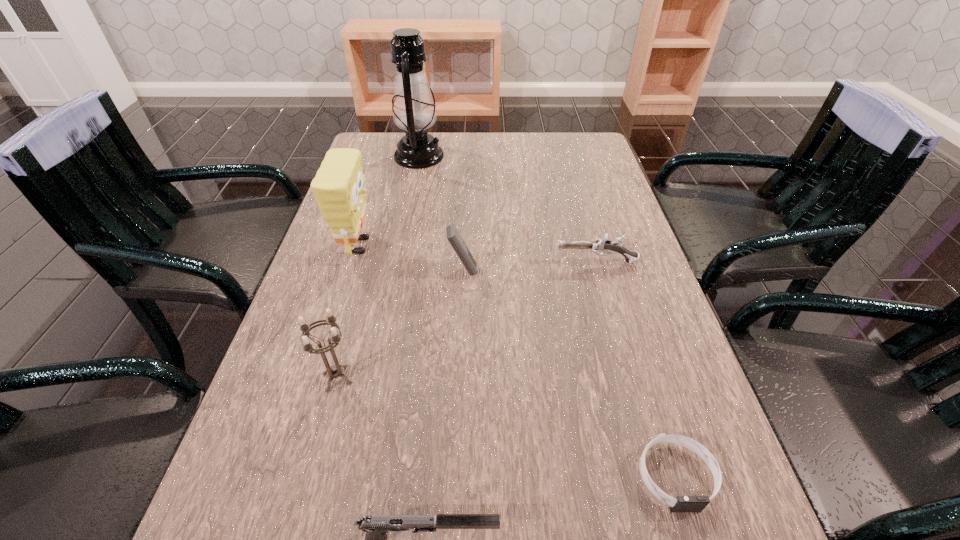
This screenshot has width=960, height=540. I want to click on vacant space located 0.100m on the face of the sponge, so click(x=420, y=246).

This screenshot has width=960, height=540. Identify the location of vacant space located 0.120m on the right of the third nearest object. (423, 378).

Find the location of `free space located 0.100m on the front-facing side of the fourth tallest object`. free space located 0.100m on the front-facing side of the fourth tallest object is located at coordinates (521, 269).

Locate an element on the screen. The image size is (960, 540). free space located aimed along the barrel of the right gun is located at coordinates pyautogui.click(x=487, y=262).

You are a GUI agent. You are given a task and a screenshot of the screen. Output one action in this format:
    pyautogui.click(x=<x>, y=<y>)
    Task: Click on the vacant space situated 0.370m aimed along the barrel of the right gun
    
    Given the screenshot: What is the action you would take?
    pyautogui.click(x=396, y=262)

Locate an element on the screen. vacant space positioned 0.230m aimed along the barrel of the right gun is located at coordinates (456, 262).

The width and height of the screenshot is (960, 540). In order to click on object located at the far edge in this screenshot , I will do `click(413, 108)`.

Locate an element on the screen. Image resolution: width=960 pixels, height=540 pixels. oil lamp present at the left edge is located at coordinates (413, 108).

Identify the location of sponge at the left edge. (338, 186).

The width and height of the screenshot is (960, 540). I want to click on candle holder located at the left edge, so click(x=334, y=371).